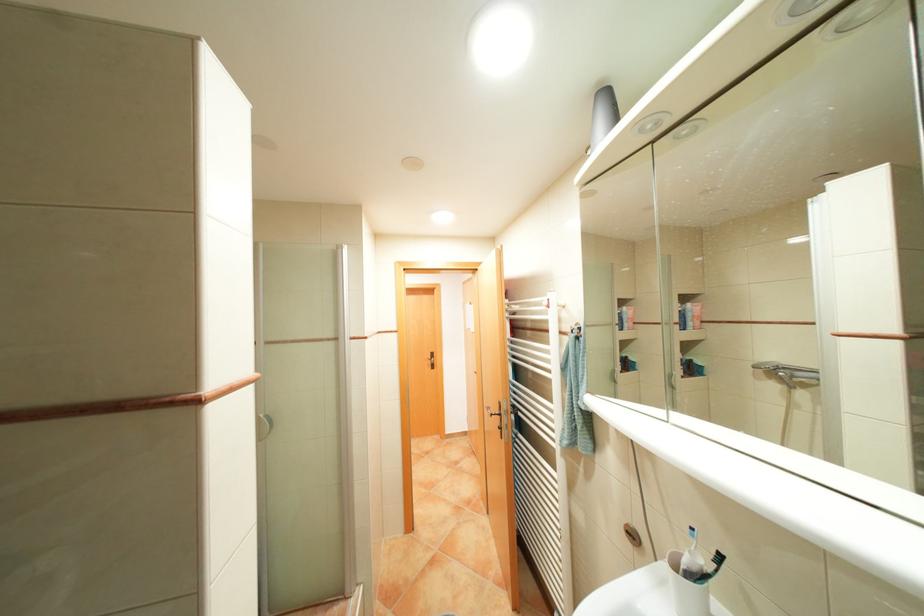
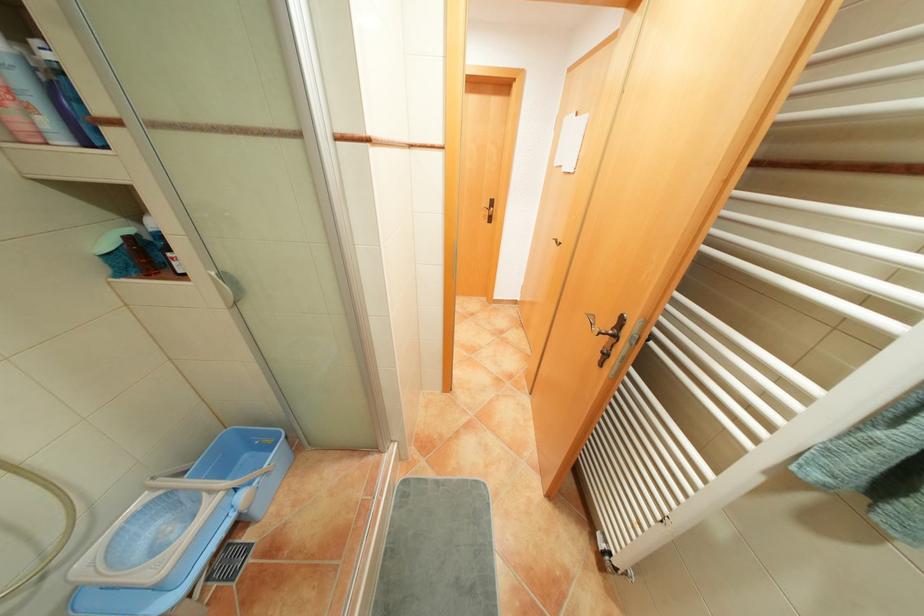
Where in the second image is the point corresponding to the point at 502,414 from the first image?

(609, 333)